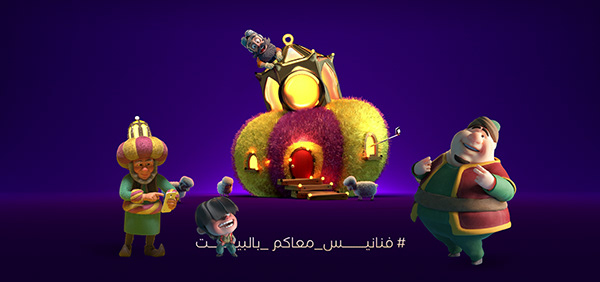
This screenshot has height=282, width=600. What are the coordinates of `light` in the screenshot? It's located at (x=300, y=187), (x=252, y=152).